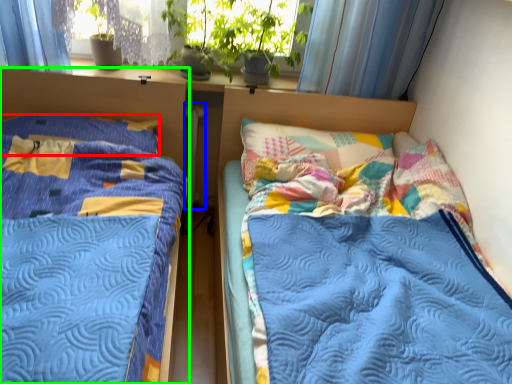
Question: Estimate the real-world distances between objects in this image. Which object is closer to pillow (highlighted by a red box), radiator (highlighted by a blue box) or bed (highlighted by a green box)?

Choices:
 (A) radiator
 (B) bed

Answer: (B)